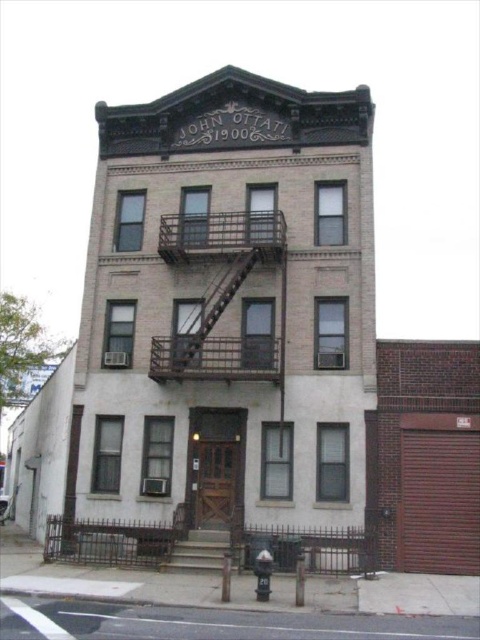
You are a maintenance worker needing to access the third floor of the building. You see the metallic fire escape at center and the brown wooden stairs at center. Which path would require you to climb a greater vertical distance?

The metallic fire escape at center and brown wooden stairs at center are 20.95 feet apart. Since the fire escape is typically attached to the exterior and the stairs are likely inside, the vertical distance to climb would depend on their positions. However, the question specifies the distance between them, so the answer should focus on that. Wait, the objects description says they are 20.95 feet apart. But the question is about vertical distance. Hmm, perhaps the fire escape is lower or higher? The scene is

You are standing in front of the building and want to enter through the main entrance. Which object, the metallic fire escape at center or the brown wooden stairs at center, is closer to you as you approach the building?

The metallic fire escape at center is closer to you than the brown wooden stairs at center as you approach the building.